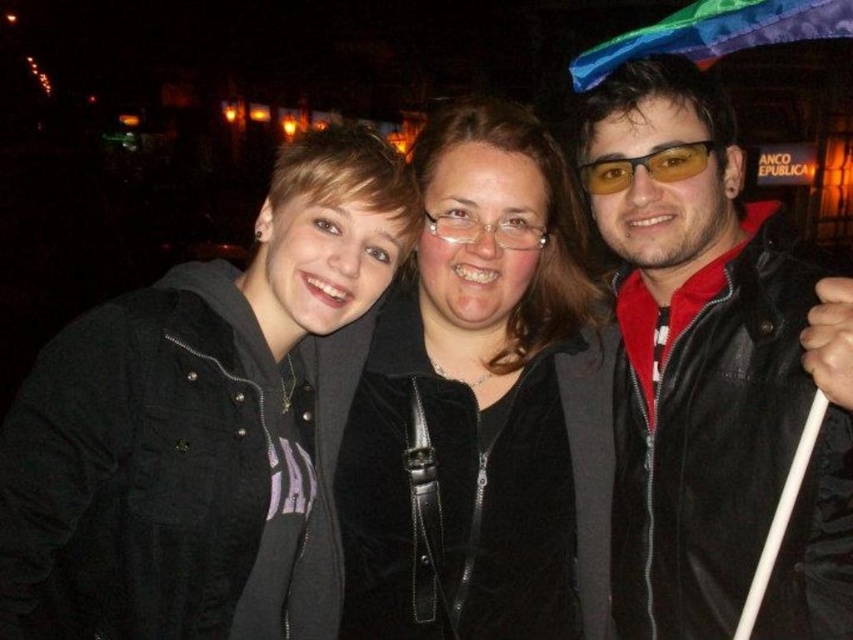
You are a photographer trying to adjust the focus of your camera. You want to ensure that both the matte black jacket at right and the yellow tinted plastic glasses at center are in focus. Which object should you focus on first to achieve this?

You should focus on the matte black jacket at right first because it has a greater height compared to the yellow tinted plastic glasses at center, so focusing on the farther object first will help both be in focus.

You are a photographer trying to capture a closeup of the velvet black jacket at center and the yellow tinted plastic glasses at center in the image. Can you fit both items in the frame if your camera has a maximum field of view that can capture objects up to 30 inches apart?

The distance between the velvet black jacket at center and the yellow tinted plastic glasses at center is 29.94 inches, which is just under the camera maximum field of view of 30 inches. Therefore, both items can fit in the frame.

You are standing in front of the group of three people in the image. You want to throw a small ball to the point closest to you between the two points labeled as point [685,486] and point [431,147]. Which point should you aim for?

You should aim for point [685,486] because it is closer to you than point [431,147].